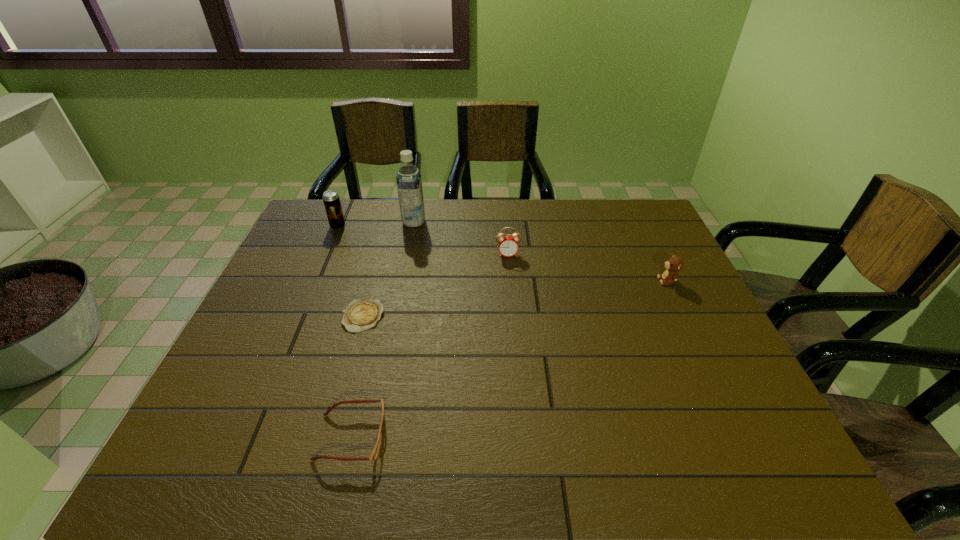
Where is `vacant space at the far right corner of the desktop`? This screenshot has width=960, height=540. vacant space at the far right corner of the desktop is located at coordinates (615, 221).

This screenshot has height=540, width=960. In order to click on vacant area at the near right corner in this screenshot , I will do `click(762, 443)`.

Where is `free area in between the nearest object and the third nearest object`? free area in between the nearest object and the third nearest object is located at coordinates (509, 359).

Identify the location of empty space that is in between the shortest object and the fifth object from left to right. The height and width of the screenshot is (540, 960). (436, 285).

Identify the location of free space that is in between the quiche and the spectacles. Image resolution: width=960 pixels, height=540 pixels. (357, 376).

This screenshot has height=540, width=960. I want to click on vacant space in between the fifth farthest object and the fifth shortest object, so click(x=350, y=271).

Locate an element on the screen. This screenshot has height=540, width=960. unoccupied area between the fifth tallest object and the second object from right to left is located at coordinates (429, 346).

Where is `free point between the fifth tallest object and the tallest object`? free point between the fifth tallest object and the tallest object is located at coordinates (382, 329).

Where is `blank region between the spectacles and the soya milk`? blank region between the spectacles and the soya milk is located at coordinates (382, 329).

Where is `empty space that is in between the leftmost object and the fifth object from left to right`? empty space that is in between the leftmost object and the fifth object from left to right is located at coordinates (423, 240).